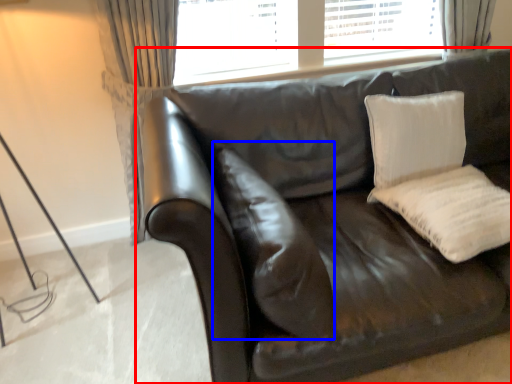
Question: Which object is closer to the camera taking this photo, studio couch (highlighted by a red box) or pillow (highlighted by a blue box)?

Choices:
 (A) studio couch
 (B) pillow

Answer: (A)